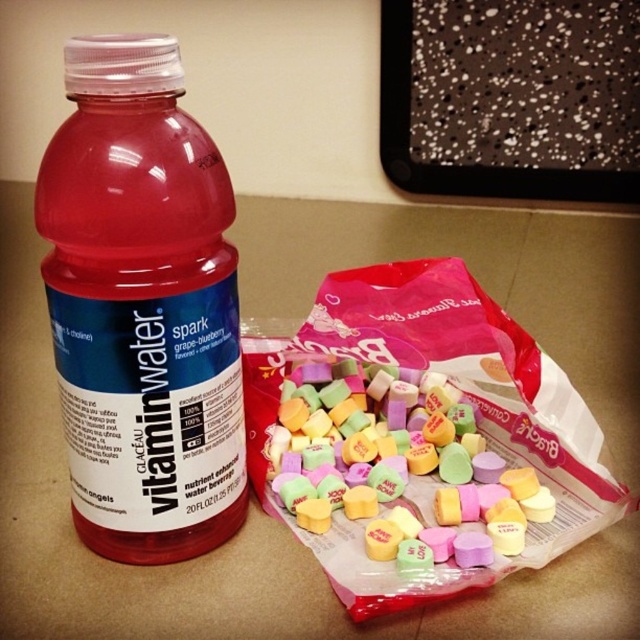
Between point (515, 413) and point (320, 509), which one is positioned behind?

Point (515, 413)

Can you confirm if translucent plastic bag of heart-shaped candies at lower right is thinner than pastel heart-shaped candies at center?

No.

What do you see at coordinates (419, 436) in the screenshot? The image size is (640, 640). I see `translucent plastic bag of heart-shaped candies at lower right` at bounding box center [419, 436].

Find the location of a particular element. translucent plastic bag of heart-shaped candies at lower right is located at coordinates (419, 436).

Is matte plastic vitaminwater at left above pastel heart-shaped candies at center?

Indeed, matte plastic vitaminwater at left is positioned over pastel heart-shaped candies at center.

You are a GUI agent. You are given a task and a screenshot of the screen. Output one action in this format:
    pyautogui.click(x=<x>, y=<y>)
    Task: Click on the matte plastic vitaminwater at left
    The height and width of the screenshot is (640, 640).
    Given the screenshot: What is the action you would take?
    pyautogui.click(x=141, y=292)

Does translucent plastic bag of heart-shaped candies at lower right appear on the left side of matte plastic vitaminwater at left?

Incorrect, translucent plastic bag of heart-shaped candies at lower right is not on the left side of matte plastic vitaminwater at left.

Could you measure the distance between translucent plastic bag of heart-shaped candies at lower right and matte plastic vitaminwater at left?

They are 25.37 centimeters apart.

Find the location of a particular element. Image resolution: width=640 pixels, height=640 pixels. translucent plastic bag of heart-shaped candies at lower right is located at coordinates (419, 436).

This screenshot has width=640, height=640. I want to click on translucent plastic bag of heart-shaped candies at lower right, so click(419, 436).